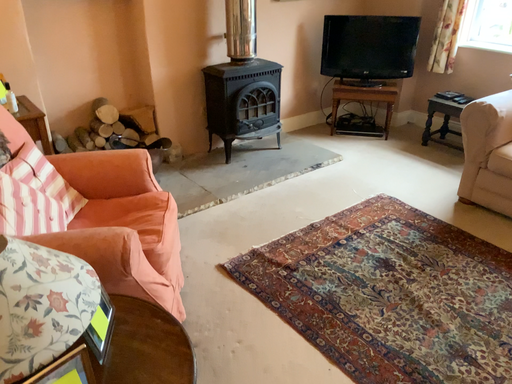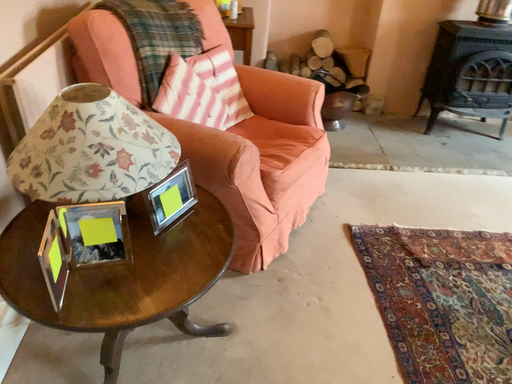
Question: How did the camera likely rotate when shooting the video?

Choices:
 (A) rotated left
 (B) rotated right

Answer: (A)